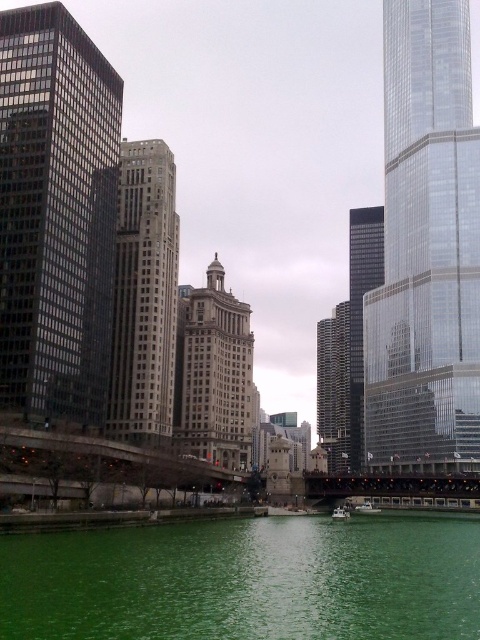
Question: Which of the following is the farthest from the observer?

Choices:
 (A) (36, 326)
 (B) (360, 400)

Answer: (B)

Question: Can you confirm if glassy reflective skyscraper at left is wider than dark gray glass skyscraper at center?

Choices:
 (A) no
 (B) yes

Answer: (B)

Question: Which point is farther to the camera?

Choices:
 (A) glassy reflective skyscraper at center
 (B) matte gray building at center

Answer: (A)

Question: Which object is the farthest from the white glossy boat at center?

Choices:
 (A) green glass boat at center
 (B) glassy reflective skyscraper at center
 (C) matte gray building at center
 (D) glassy reflective skyscraper at left

Answer: (B)

Question: Can you confirm if green liquid at lower center is smaller than green glass boat at center?

Choices:
 (A) yes
 (B) no

Answer: (B)

Question: Is gray stone building at center thinner than glassy reflective skyscraper at center?

Choices:
 (A) yes
 (B) no

Answer: (B)